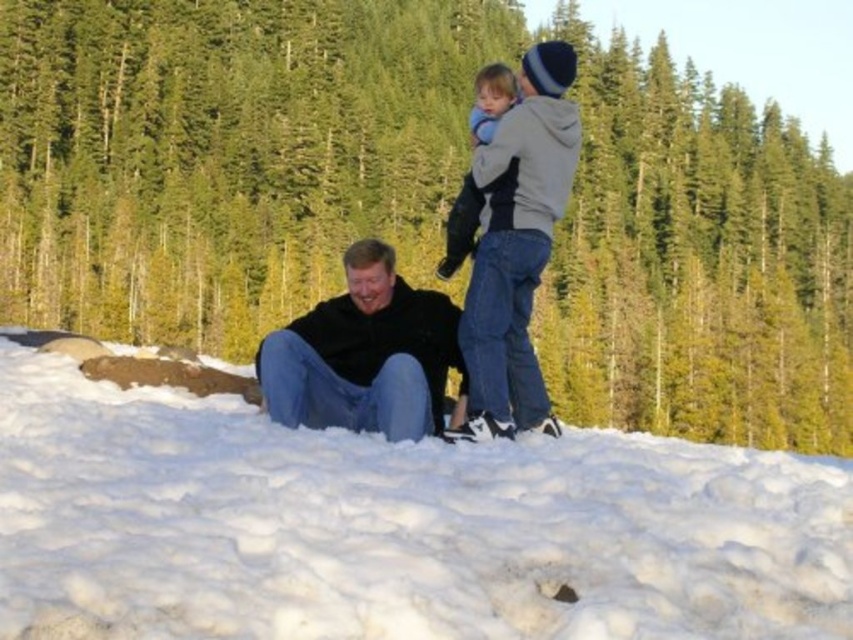
Who is positioned more to the right, green textured pine tree at upper center or light blue denim jeans at upper right?

green textured pine tree at upper center is more to the right.

Can you confirm if green textured pine tree at upper center is positioned to the left of light blue denim jeans at upper right?

Incorrect, green textured pine tree at upper center is not on the left side of light blue denim jeans at upper right.

Measure the distance between point (428, 209) and camera.

Point (428, 209) is 114.62 meters from camera.

Identify the location of green textured pine tree at upper center. (225, 154).

Is point (502, 419) closer to camera compared to point (473, 188)?

Yes, point (502, 419) is in front of point (473, 188).

Between light blue denim jeans at upper right and light blue fleece jacket at upper center, which one has less height?

light blue denim jeans at upper right

Which is in front, point (502, 136) or point (497, 116)?

Point (502, 136) is in front.

Where is `light blue denim jeans at upper right`? The image size is (853, 640). light blue denim jeans at upper right is located at coordinates (515, 246).

Between white fluffy snow at lower center and light blue denim jeans at upper right, which one has less height?

white fluffy snow at lower center is shorter.

Is white fluffy snow at lower center to the right of light blue denim jeans at upper right from the viewer's perspective?

In fact, white fluffy snow at lower center is to the left of light blue denim jeans at upper right.

The height and width of the screenshot is (640, 853). Identify the location of white fluffy snow at lower center. (393, 525).

At what (x,y) coordinates should I click in order to perform the action: click on white fluffy snow at lower center. Please return your answer as a coordinate pair (x, y). The height and width of the screenshot is (640, 853). Looking at the image, I should click on (393, 525).